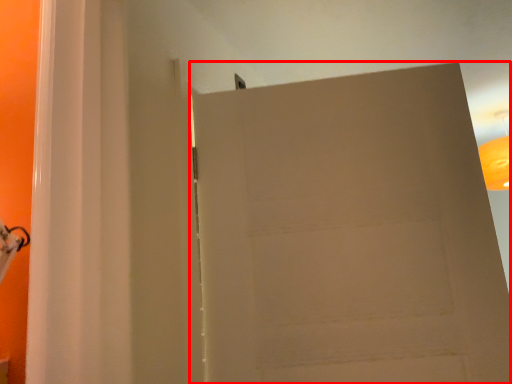
Question: From the image's perspective, what is the correct spatial relationship of door (annotated by the red box) in relation to lamp?

Choices:
 (A) below
 (B) above

Answer: (A)